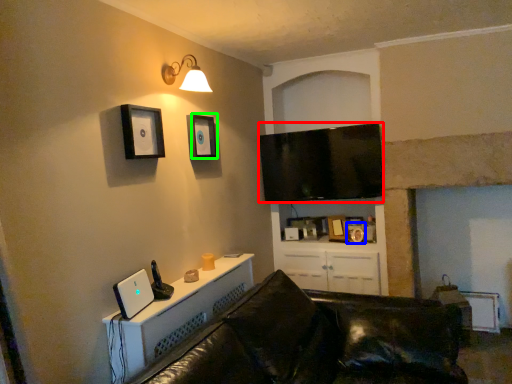
Question: Which is nearer to the television (highlighted by a red box)? picture frame (highlighted by a blue box) or picture frame (highlighted by a green box).

Choices:
 (A) picture frame
 (B) picture frame

Answer: (A)